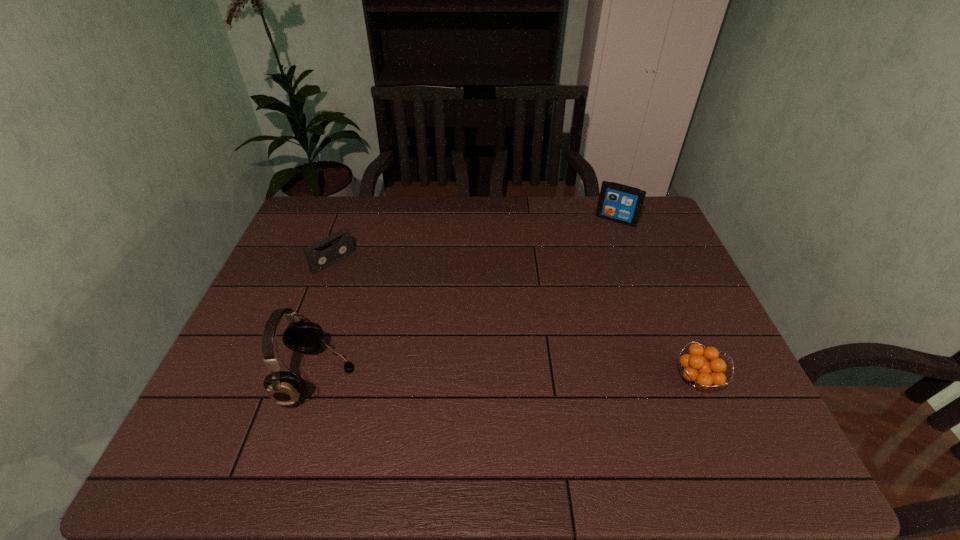
Find the location of a particular element. The width and height of the screenshot is (960, 540). the tallest object is located at coordinates (285, 388).

Find the location of a particular element. The height and width of the screenshot is (540, 960). orange fruit is located at coordinates (701, 374).

This screenshot has height=540, width=960. What are the coordinates of `the second tallest object` in the screenshot? It's located at (617, 202).

Where is `iPod`? This screenshot has width=960, height=540. iPod is located at coordinates (617, 202).

The width and height of the screenshot is (960, 540). Identify the location of videotape. (320, 255).

At what (x,y) coordinates should I click in order to perform the action: click on free space located with the microphone on the side of the headset. Please return your answer as a coordinate pair (x, y). The width and height of the screenshot is (960, 540). Looking at the image, I should click on (413, 377).

I want to click on vacant region located 0.230m on the front screen of the second tallest object, so click(587, 267).

Find the location of `free location located on the front screen of the second tallest object`. free location located on the front screen of the second tallest object is located at coordinates (578, 283).

Locate an element on the screen. The height and width of the screenshot is (540, 960). vacant area situated on the front screen of the second tallest object is located at coordinates (587, 267).

This screenshot has width=960, height=540. Identify the location of free space located on the front-facing side of the second farthest object. (373, 296).